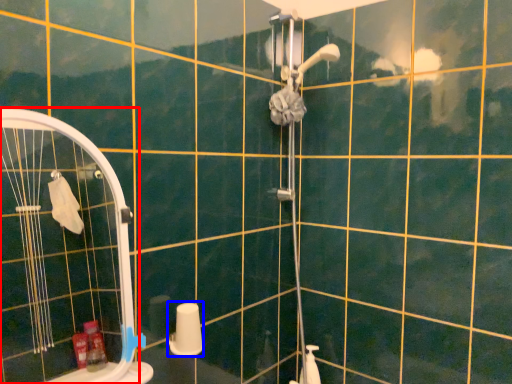
Question: Which object appears farthest to the camera in this image, screen door (highlighted by a red box) or toilet paper (highlighted by a blue box)?

Choices:
 (A) screen door
 (B) toilet paper

Answer: (B)